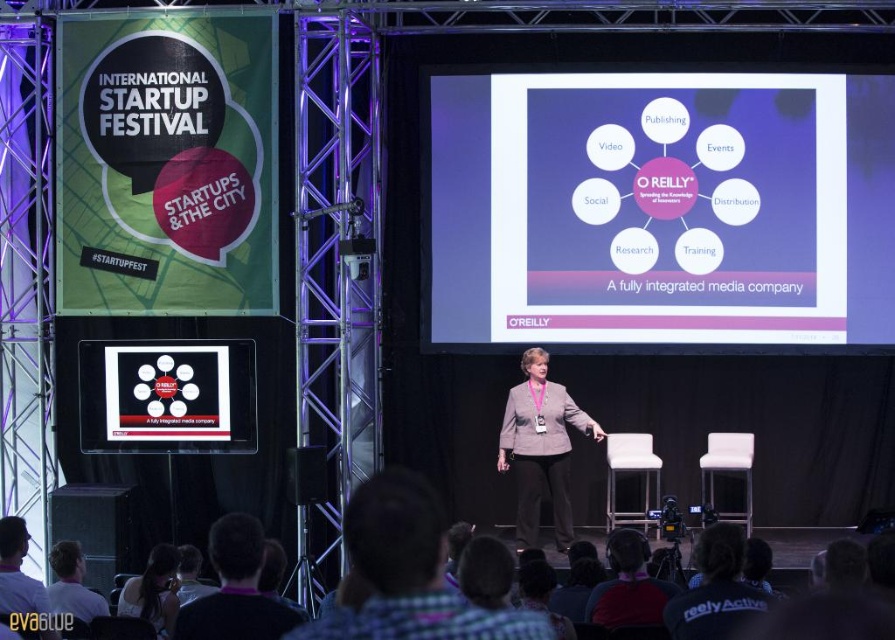
You are an attendee at the International Startup Festival. You notice the purple matte circle at center and the light brown leather jacket at lower left. Which object appears bigger in the image?

The purple matte circle at center is larger in size than the light brown leather jacket at lower left.

You are a photographer at the festival and want to capture both the banner and the presentation slide in a single shot. The banner is at point (145, 342) and the slide is at point (65, 541). Which object should you focus on first to ensure both are in focus?

Since point (145, 342) is closer to the viewer than point (65, 541), you should focus on the banner at point (145, 342) first to ensure both are in focus.